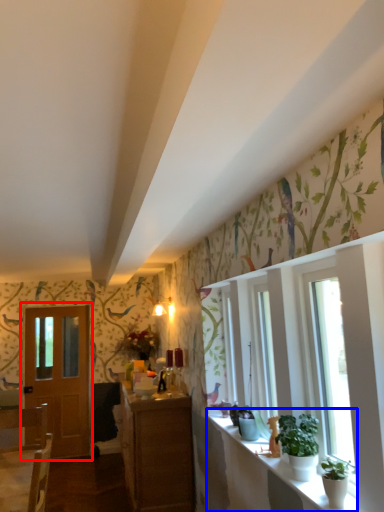
Question: Which point is closer to the camera, door (highlighted by a red box) or window sill (highlighted by a blue box)?

Choices:
 (A) door
 (B) window sill

Answer: (B)